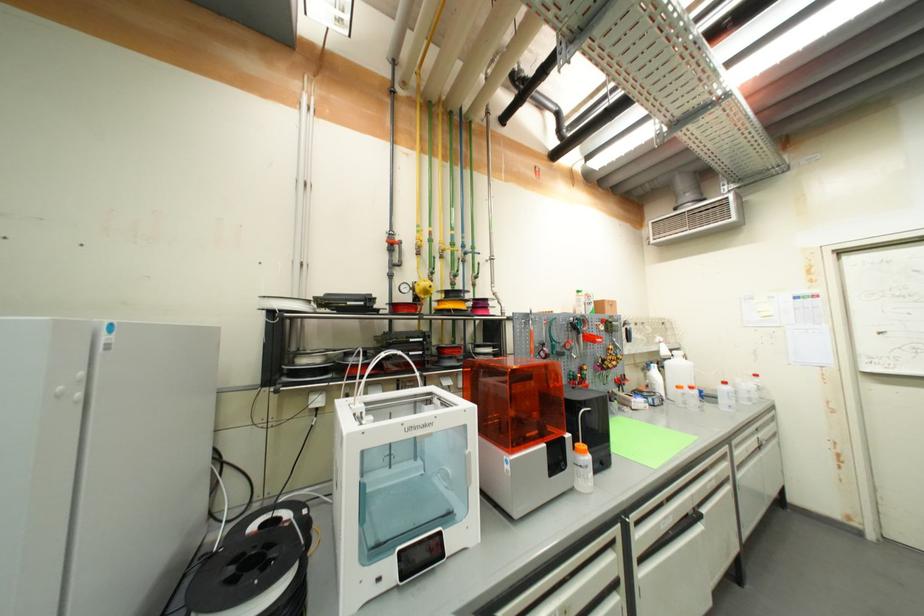
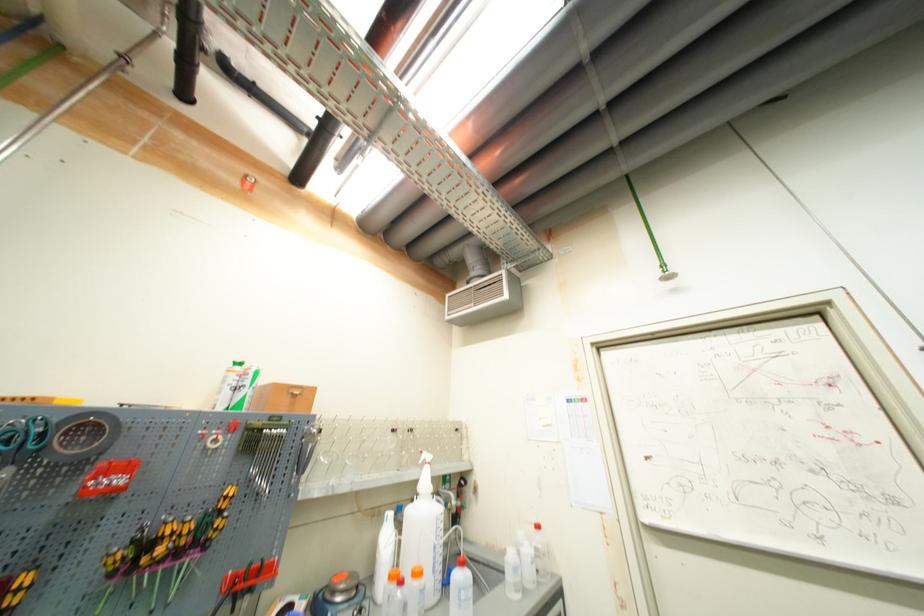
The point at (542, 175) is marked in the first image. Where is the corresponding point in the second image?

(253, 185)